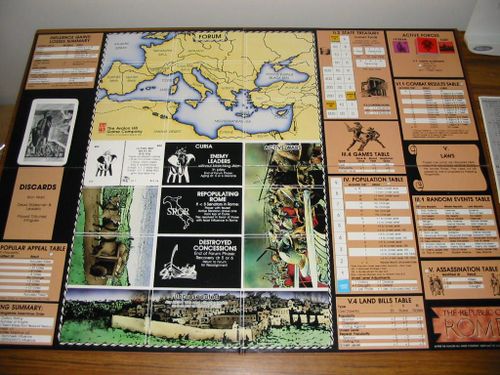
You are a GUI agent. You are given a task and a screenshot of the screen. Output one action in this format:
    pyautogui.click(x=<x>, y=<y>)
    Task: Click on the table
    
    Given the screenshot: What is the action you would take?
    pyautogui.click(x=256, y=362)